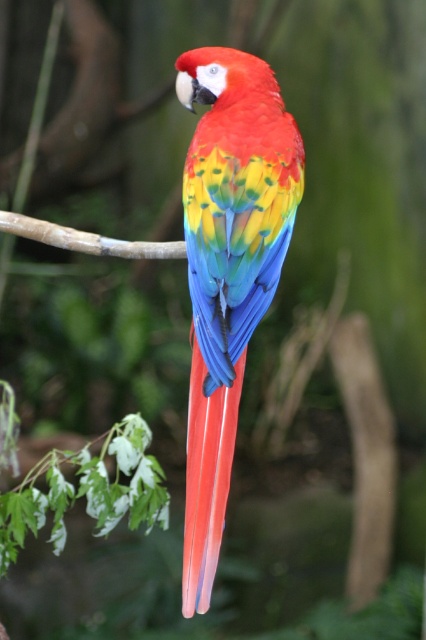
Where is the glossy feathers parrot at center located in the image?

The glossy feathers parrot at center is located at the 2D coordinates point (227,268).